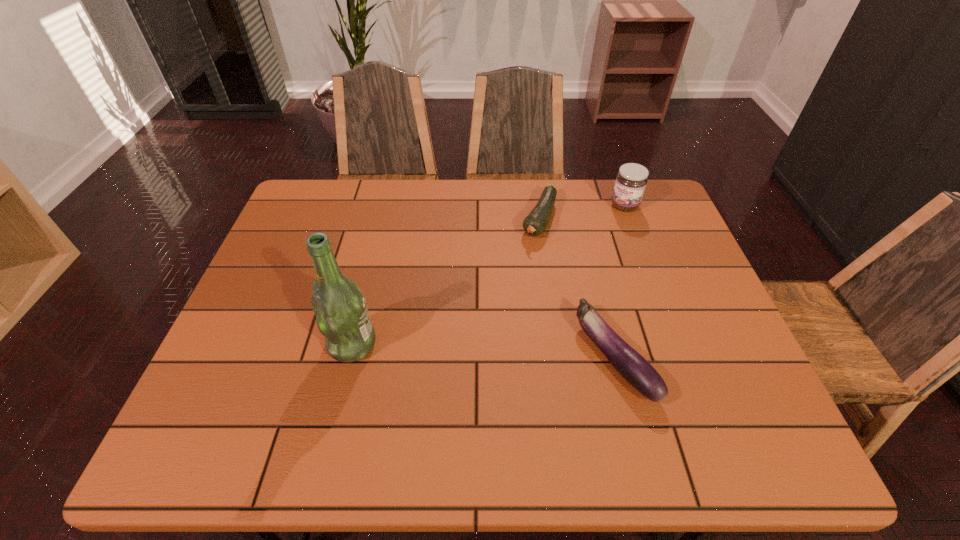
The image size is (960, 540). In order to click on blank region between the third shortest object and the eggplant in this screenshot , I will do `click(619, 281)`.

Image resolution: width=960 pixels, height=540 pixels. In order to click on free space that is in between the zucchini and the third shortest object in this screenshot , I will do `click(582, 212)`.

Where is `vacant space in between the zucchini and the leftmost object`? vacant space in between the zucchini and the leftmost object is located at coordinates (445, 282).

You are a GUI agent. You are given a task and a screenshot of the screen. Output one action in this format:
    pyautogui.click(x=<x>, y=<y>)
    Task: Click on the free spot between the tallest object and the eggplant
    This screenshot has width=960, height=540.
    Given the screenshot: What is the action you would take?
    pyautogui.click(x=483, y=351)

This screenshot has width=960, height=540. Find the location of `vacant space in between the zucchini and the eggplant`. vacant space in between the zucchini and the eggplant is located at coordinates (577, 288).

In order to click on vacant area that lies between the rightmost object and the eggplant in this screenshot , I will do `click(619, 281)`.

The image size is (960, 540). Identify the location of vacant area that lies between the zucchini and the jam. (582, 212).

Find the location of `object that ranks as the second closest to the beer bottle`. object that ranks as the second closest to the beer bottle is located at coordinates tap(634, 368).

Where is `object that is the closest to the eggplant`? This screenshot has height=540, width=960. object that is the closest to the eggplant is located at coordinates (535, 223).

Locate an element on the screen. free point that satisfies the following two spatial constraints: 1. on the back side of the eggplant; 2. on the left side of the jam is located at coordinates (576, 206).